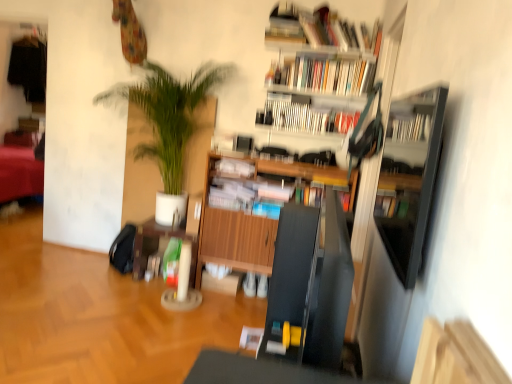
This screenshot has height=384, width=512. I want to click on green leafy plant at upper left, so click(167, 128).

This screenshot has width=512, height=384. I want to click on wooden bookshelf at upper center, so click(x=322, y=51).

The image size is (512, 384). Describe the element at coordinates (157, 246) in the screenshot. I see `wooden cabinet at center` at that location.

The image size is (512, 384). Identify the location of black glossy shelf at right, marked as the second shelf in a back-to-front arrangement. (409, 178).

Which of these two, black glossy shelf at right, marked as the second shelf in a back-to-front arrangement, or hardcover books at upper center, the 2th book when ordered from top to bottom, stands shorter?

Standing shorter between the two is hardcover books at upper center, the 2th book when ordered from top to bottom.

Is black glossy shelf at right, marked as the second shelf in a back-to-front arrangement, far from hardcover books at upper center, the third book from the bottom?

black glossy shelf at right, marked as the second shelf in a back-to-front arrangement, is far away from hardcover books at upper center, the third book from the bottom.

What's the angular difference between black glossy shelf at right, positioned as the first shelf in front-to-back order, and hardcover books at upper center, the third book from the bottom,'s facing directions?

The angle between the facing direction of black glossy shelf at right, positioned as the first shelf in front-to-back order, and the facing direction of hardcover books at upper center, the third book from the bottom, is 89.9 degrees.

Does black glossy shelf at right, positioned as the first shelf in front-to-back order, have a smaller size compared to hardcover books at upper center, the 2th book when ordered from top to bottom?

Yes.

From the image's perspective, is wooden bookshelf at upper center located above or below hardcover books at upper center, placed as the first book when sorted from top to bottom?

Clearly, from the image's perspective, wooden bookshelf at upper center is below hardcover books at upper center, placed as the first book when sorted from top to bottom.

How many degrees apart are the facing directions of wooden bookshelf at upper center and hardcover books at upper center, placed as the first book when sorted from top to bottom?

wooden bookshelf at upper center and hardcover books at upper center, placed as the first book when sorted from top to bottom, are facing 0.000568 degrees away from each other.

Can you confirm if wooden bookshelf at upper center is thinner than hardcover books at upper center, the fourth book positioned from the bottom?

No.

Is wooden bookshelf at upper center in contact with hardcover books at upper center, the fourth book positioned from the bottom?

Yes, wooden bookshelf at upper center is beside hardcover books at upper center, the fourth book positioned from the bottom.

Is green leafy plant at upper left thinner than hardcover books at upper center, the fourth book positioned from the bottom?

Incorrect, the width of green leafy plant at upper left is not less than that of hardcover books at upper center, the fourth book positioned from the bottom.

From the image's perspective, is green leafy plant at upper left above hardcover books at upper center, the fourth book positioned from the bottom?

No, from the image's perspective, green leafy plant at upper left is not above hardcover books at upper center, the fourth book positioned from the bottom.

Locate an element on the screen. the 4th book counting from the right of the green leafy plant at upper left is located at coordinates (320, 30).

From a real-world perspective, is green leafy plant at upper left under hardcover books at upper center, the fourth book positioned from the bottom?

Correct, in the physical world, green leafy plant at upper left is lower than hardcover books at upper center, the fourth book positioned from the bottom.

From a real-world perspective, is hardcover books at upper center, placed as the first book when sorted from top to bottom, physically located above or below hardcover books at upper center, the third book from the bottom?

hardcover books at upper center, placed as the first book when sorted from top to bottom, is above hardcover books at upper center, the third book from the bottom.

How much distance is there between hardcover books at upper center, placed as the first book when sorted from top to bottom, and hardcover books at upper center, the 2th book when ordered from top to bottom?

The distance of hardcover books at upper center, placed as the first book when sorted from top to bottom, from hardcover books at upper center, the 2th book when ordered from top to bottom, is 7.87 inches.

Identify the location of book located on the right of hardcover books at upper center, the third book from the bottom. (320, 30).

Is hardcover books at upper center, the fourth book positioned from the bottom, facing towards hardcover books at upper center, the third book from the bottom?

No, hardcover books at upper center, the fourth book positioned from the bottom, is not aimed at hardcover books at upper center, the third book from the bottom.

The height and width of the screenshot is (384, 512). I want to click on bookcase below the hardcover books at upper center, the fourth book positioned from the bottom (from a real-world perspective), so point(322,51).

Is hardcover books at upper center, placed as the first book when sorted from top to bottom, far from wooden bookshelf at upper center?

They are positioned close to each other.

In the scene shown: Which object is further away from the camera taking this photo, hardcover books at upper center, placed as the first book when sorted from top to bottom, or wooden bookshelf at upper center?

wooden bookshelf at upper center.

Can you confirm if hardcover books at upper center, the fourth book positioned from the bottom, is thinner than wooden bookshelf at upper center?

Yes.

From the image's perspective, is hardcover book at upper center, which is counted as the 2th book, starting from the bottom, beneath hardcover books at upper center, the third book from the bottom?

Correct, hardcover book at upper center, which is counted as the 2th book, starting from the bottom, appears lower than hardcover books at upper center, the third book from the bottom, in the image.

From a real-world perspective, relative to hardcover books at upper center, the third book from the bottom, is hardcover book at upper center, which appears as the third book when viewed from the top, vertically above or below?

From a real-world perspective, hardcover book at upper center, which appears as the third book when viewed from the top, is physically below hardcover books at upper center, the third book from the bottom.

In terms of width, does hardcover book at upper center, which appears as the third book when viewed from the top, look wider or thinner when compared to hardcover books at upper center, the 2th book when ordered from top to bottom?

Considering their sizes, hardcover book at upper center, which appears as the third book when viewed from the top, looks slimmer than hardcover books at upper center, the 2th book when ordered from top to bottom.

Is hardcover book at upper center, which appears as the third book when viewed from the top, inside the boundaries of hardcover books at upper center, the third book from the bottom, or outside?

The correct answer is: outside.

Identify the location of shelf that is the 1st object located in front of the hardcover books at upper center, placed as the first book when sorted from top to bottom. (233, 235).

How many degrees apart are the facing directions of hardcover books at upper center, the fourth book positioned from the bottom, and wooden cabinet at center, which appears as the 1th shelf when viewed from the back?

hardcover books at upper center, the fourth book positioned from the bottom, and wooden cabinet at center, which appears as the 1th shelf when viewed from the back, are facing 1.71 degrees away from each other.

Based on the photo, would you say hardcover books at upper center, placed as the first book when sorted from top to bottom, contains wooden cabinet at center, which is counted as the second shelf, starting from the front?

Definitely not — wooden cabinet at center, which is counted as the second shelf, starting from the front, is not inside hardcover books at upper center, placed as the first book when sorted from top to bottom.

Looking at their sizes, would you say hardcover books at upper center, the fourth book positioned from the bottom, is wider or thinner than wooden cabinet at center, which is counted as the second shelf, starting from the front?

In the image, hardcover books at upper center, the fourth book positioned from the bottom, appears to be more narrow than wooden cabinet at center, which is counted as the second shelf, starting from the front.

Starting from the black glossy shelf at right, marked as the second shelf in a back-to-front arrangement, which book is the 2nd one to the right? Please provide its 2D coordinates.

[(323, 75)]

Image resolution: width=512 pixels, height=384 pixels. In order to click on bookcase below the hardcover books at upper center, placed as the first book when sorted from top to bottom (from the image's perspective) in this screenshot , I will do `click(322, 51)`.

Based on the photo, which object lies further to the anchor point hardcover books at upper center, the fourth book positioned from the bottom, black glossy shelf at right, marked as the second shelf in a back-to-front arrangement, or wooden bookshelf at upper center?

The object further to hardcover books at upper center, the fourth book positioned from the bottom, is black glossy shelf at right, marked as the second shelf in a back-to-front arrangement.

Looking at the image, which one is located further to wooden bookshelf at upper center, green leafy plant at upper left or white paper at center, positioned as the fourth book in top-to-bottom order?

white paper at center, positioned as the fourth book in top-to-bottom order, is positioned further to the anchor wooden bookshelf at upper center.

From the image, which object appears to be farther from black glossy shelf at right, positioned as the first shelf in front-to-back order, green leafy plant at upper left or hardcover book at upper center, which appears as the third book when viewed from the top?

green leafy plant at upper left.

Considering their positions, is wooden bookshelf at upper center positioned further to hardcover books at upper center, the fourth book positioned from the bottom, than white paper at center, which appears as the 1th book when ordered from the bottom?

Based on the image, white paper at center, which appears as the 1th book when ordered from the bottom, appears to be further to hardcover books at upper center, the fourth book positioned from the bottom.

Looking at the image, which one is located further to wooden cabinet at center, which is counted as the second shelf, starting from the front, wooden cabinet at center or hardcover books at upper center, the third book from the bottom?

Based on the image, hardcover books at upper center, the third book from the bottom, appears to be further to wooden cabinet at center, which is counted as the second shelf, starting from the front.

Looking at the image, which one is located closer to wooden bookshelf at upper center, black glossy shelf at right, marked as the second shelf in a back-to-front arrangement, or hardcover books at upper center, placed as the first book when sorted from top to bottom?

The object closer to wooden bookshelf at upper center is hardcover books at upper center, placed as the first book when sorted from top to bottom.

When comparing their distances from wooden cabinet at center, does hardcover books at upper center, placed as the first book when sorted from top to bottom, or wooden bookshelf at upper center seem closer?

wooden bookshelf at upper center lies closer to wooden cabinet at center than the other object.

Considering their positions, is hardcover books at upper center, placed as the first book when sorted from top to bottom, positioned closer to green leafy plant at upper left than hardcover books at upper center, the third book from the bottom?

hardcover books at upper center, the third book from the bottom, is positioned closer to the anchor green leafy plant at upper left.

I want to click on bookcase between hardcover books at upper center, placed as the first book when sorted from top to bottom, and hardcover book at upper center, which appears as the third book when viewed from the top, vertically, so click(322, 51).

I want to click on book located between white paper at center, which appears as the 1th book when ordered from the bottom, and wooden bookshelf at upper center in the left-right direction, so click(x=309, y=113).

Identify the location of table located between green leafy plant at upper left and hardcover books at upper center, the 2th book when ordered from top to bottom, in the left-right direction. (157, 246).

Image resolution: width=512 pixels, height=384 pixels. What are the coordinates of `houseplant between black glossy shelf at right, positioned as the first shelf in front-to-back order, and hardcover book at upper center, which appears as the third book when viewed from the top, from front to back` in the screenshot? It's located at (167, 128).